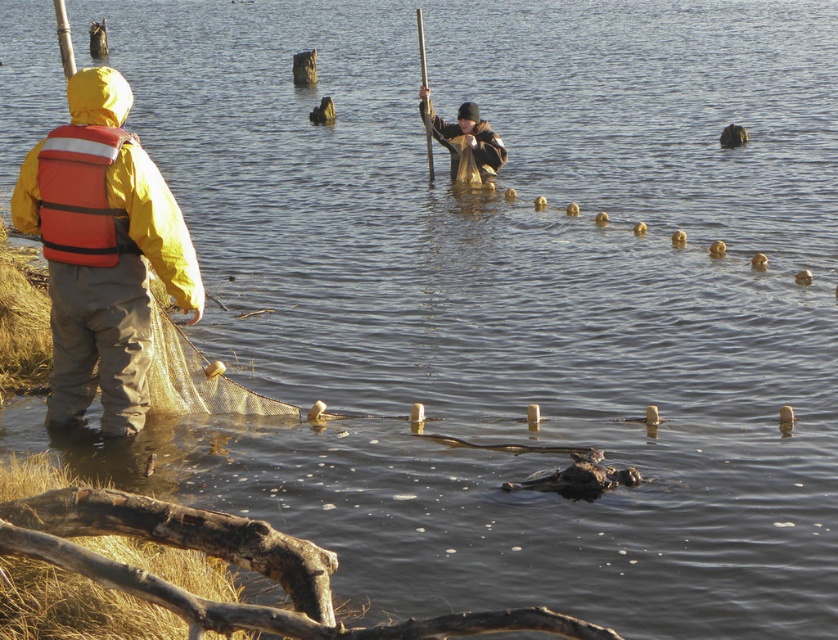
Does orange fabric life jacket at left lie in front of matte yellow jacket at center?

Yes, orange fabric life jacket at left is closer to the viewer.

Is orange fabric life jacket at left to the left of matte yellow jacket at center from the viewer's perspective?

Yes, orange fabric life jacket at left is to the left of matte yellow jacket at center.

Is point (136, 250) more distant than point (437, 129)?

No.

Identify the location of orange fabric life jacket at left. This screenshot has height=640, width=838. (80, 196).

Between orange fabric life jacket at left and translucent mesh net at center, which one has more height?

Standing taller between the two is orange fabric life jacket at left.

Does orange fabric life jacket at left appear on the right side of translucent mesh net at center?

In fact, orange fabric life jacket at left is to the left of translucent mesh net at center.

Who is more forward, (117,232) or (180,342)?

Positioned in front is point (117,232).

You are a GUI agent. You are given a task and a screenshot of the screen. Output one action in this format:
    pyautogui.click(x=<x>, y=<y>)
    Task: Click on the orange fabric life jacket at left
    This screenshot has width=838, height=640.
    Given the screenshot: What is the action you would take?
    pyautogui.click(x=80, y=196)

Does translucent mesh net at center have a lesser height compared to matte yellow jacket at center?

Yes, translucent mesh net at center is shorter than matte yellow jacket at center.

Is translucent mesh net at center above matte yellow jacket at center?

Incorrect, translucent mesh net at center is not positioned above matte yellow jacket at center.

Image resolution: width=838 pixels, height=640 pixels. What do you see at coordinates (195, 374) in the screenshot?
I see `translucent mesh net at center` at bounding box center [195, 374].

This screenshot has height=640, width=838. I want to click on translucent mesh net at center, so click(195, 374).